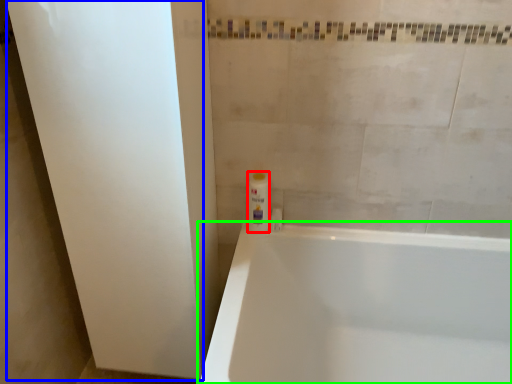
Question: Which object is positioned farthest from toiletry (highlighted by a red box)? Select from screen door (highlighted by a blue box) and bathtub (highlighted by a green box).

Choices:
 (A) screen door
 (B) bathtub

Answer: (A)